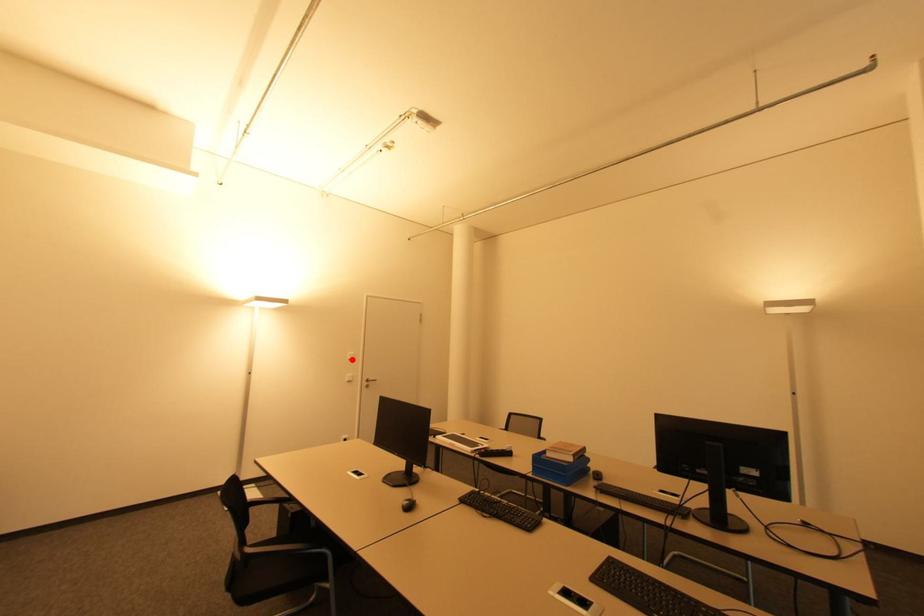
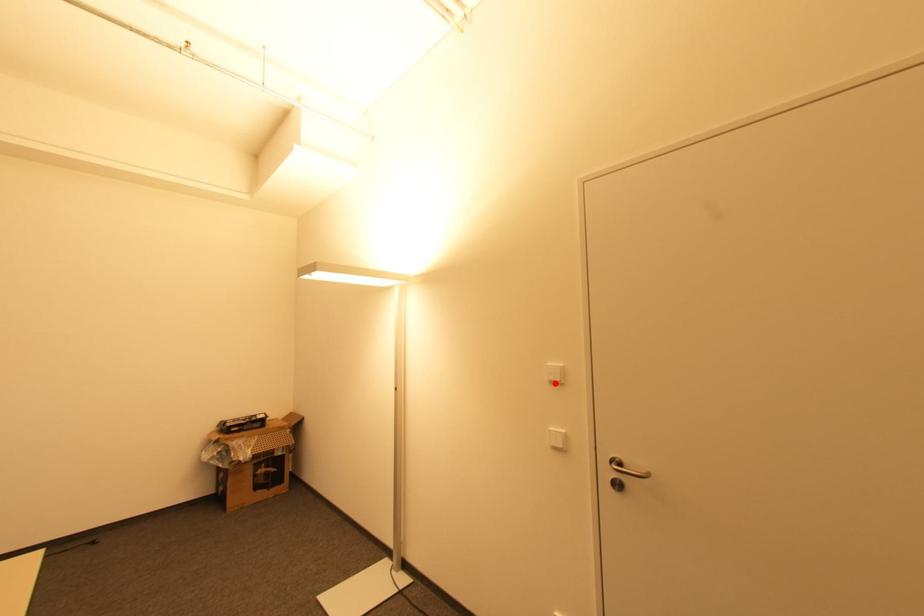
I am providing you with two images of the same scene from different viewpoints. A red point is marked on the first image and another point is marked on the second image. Does the point marked in image1 correspond to the same location as the one in image2?

Yes